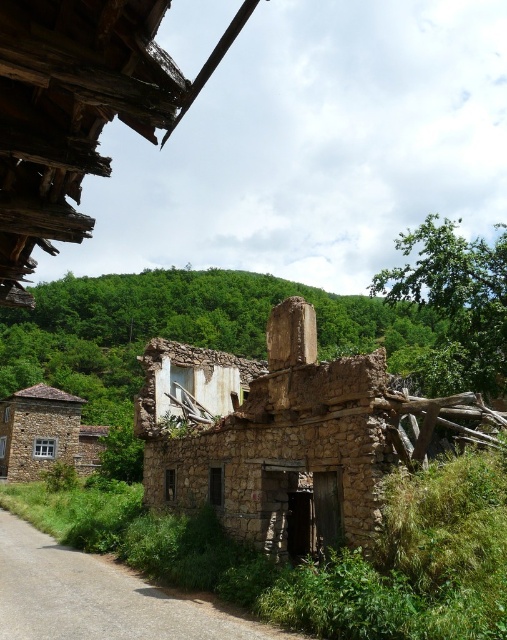
Question: Is stone rubble at center further to the viewer compared to stone/tiled hut at lower left?

Choices:
 (A) yes
 (B) no

Answer: (B)

Question: Which object is the farthest from the rusty metal roof at upper left?

Choices:
 (A) stone/tiled hut at lower left
 (B) stone rubble at center

Answer: (A)

Question: Is stone rubble at center behind rusty metal roof at upper left?

Choices:
 (A) yes
 (B) no

Answer: (A)

Question: Does stone rubble at center have a larger size compared to stone/tiled hut at lower left?

Choices:
 (A) no
 (B) yes

Answer: (B)

Question: Which point is farther to the camera?

Choices:
 (A) (35, 184)
 (B) (93, 435)

Answer: (B)

Question: Which of the following is the farthest from the observer?

Choices:
 (A) stone/tiled hut at lower left
 (B) rusty metal roof at upper left
 (C) stone rubble at center

Answer: (A)